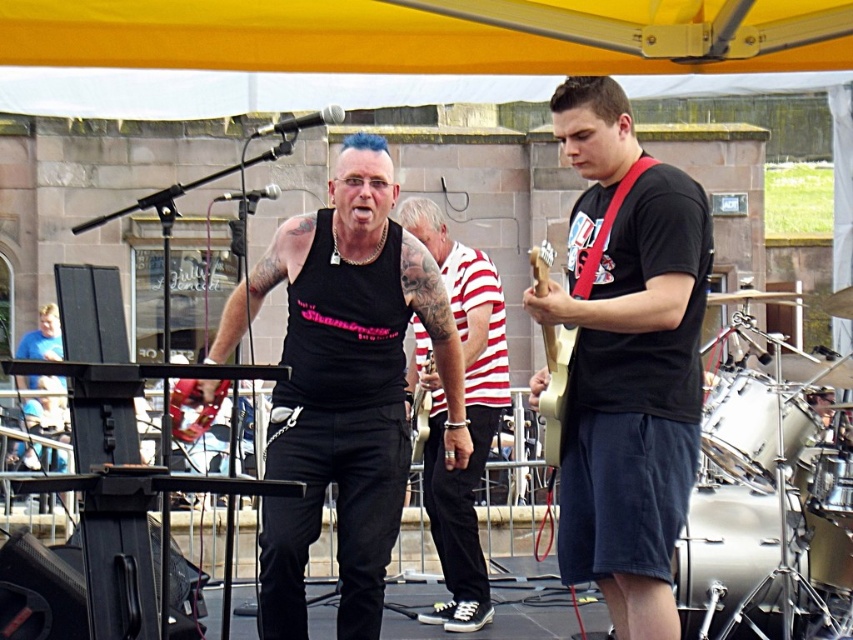
You are a photographer at the music event and want to capture the black matte tank top at center and the wooden acoustic guitar at center in a single shot. Considering their sizes, which object should you focus on to ensure both are clearly visible in the frame?

The black matte tank top at center has a larger size compared to the wooden acoustic guitar at center. To ensure both are clearly visible, focus on the black matte tank top at center since it is larger and will be more prominent in the frame.

You are a photographer at the music event and need to capture a photo of both the black matte tank top at center and the wooden acoustic guitar at center. Which object should you focus on first to ensure it appears larger in the photo?

The black matte tank top at center is taller than the wooden acoustic guitar at center, so focusing on it first will ensure it appears larger in the photo.

You are a photographer standing at the back of the venue. You want to take a clear photo of the black matte tank top at center. Considering your camera can focus up to 30 meters, will you be able to capture a clear image?

The distance of black matte tank top at center from viewer is 26.86 meters, which is within the camera focus range of 30 meters. Therefore, you can capture a clear image of the black matte tank top at center.